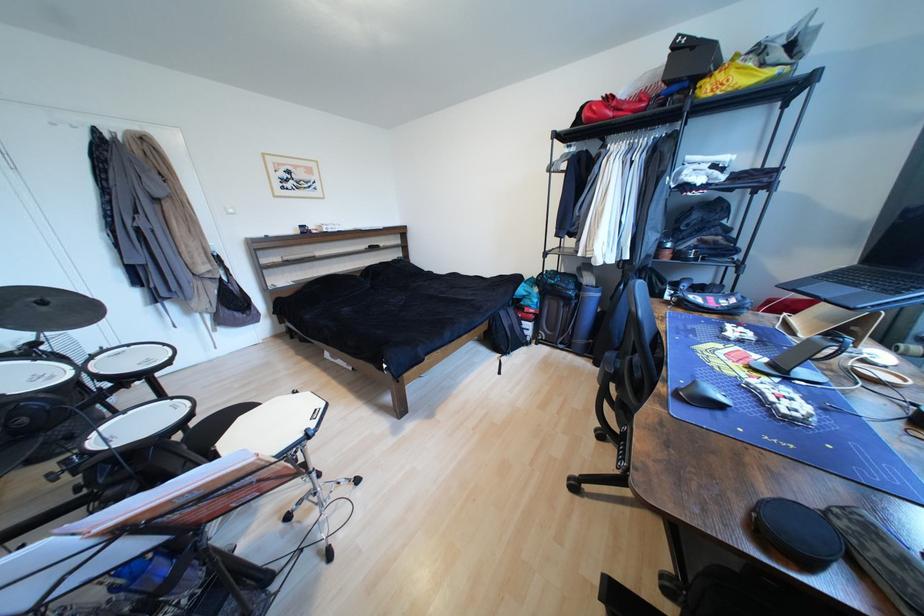
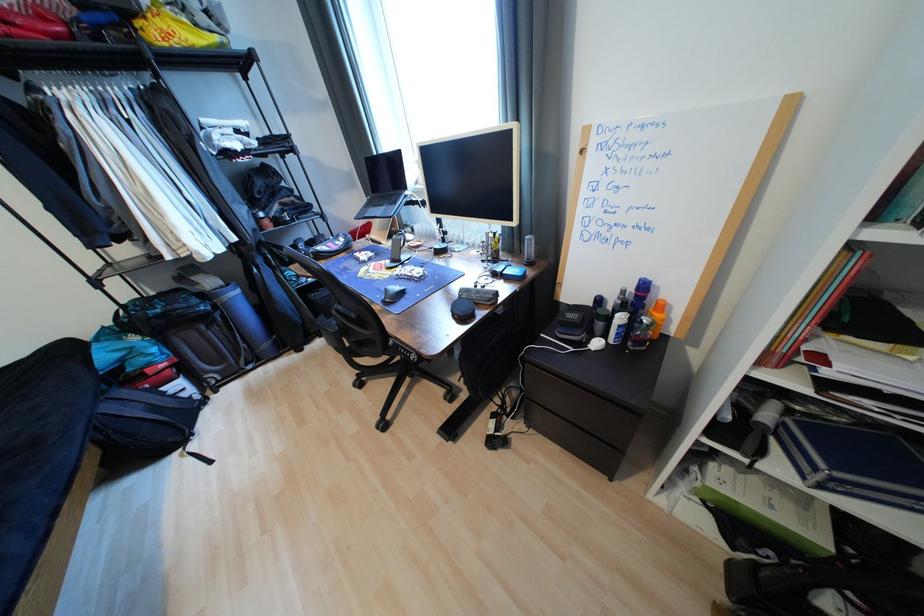
The images are taken continuously from a first-person perspective. In which direction is your viewpoint rotating?

The camera rotated toward right-down.